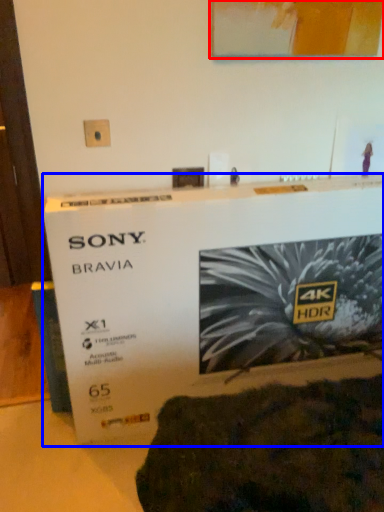
Question: Which point is further to the camera, picture frame (highlighted by a red box) or poster (highlighted by a blue box)?

Choices:
 (A) picture frame
 (B) poster

Answer: (A)